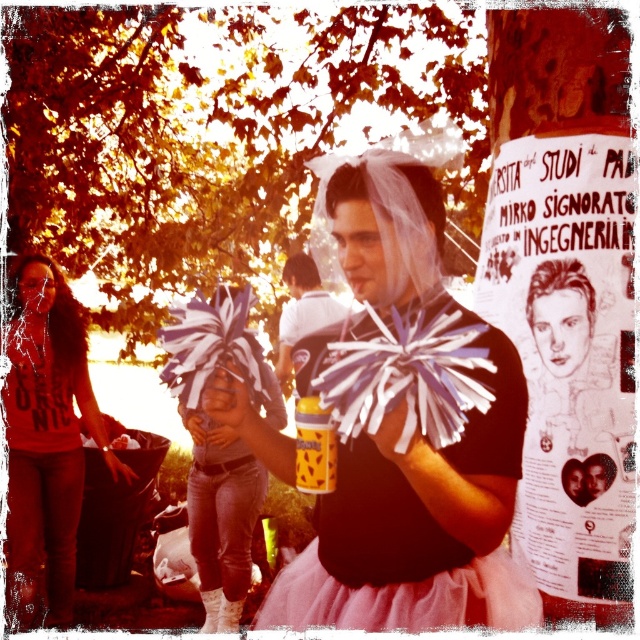
Question: Among these points, which one is nearest to the camera?

Choices:
 (A) (611, 529)
 (B) (310, 596)
 (C) (248, 524)
 (D) (49, 285)

Answer: (B)

Question: Is white paper poster at center positioned before pink tulle skirt at center?

Choices:
 (A) yes
 (B) no

Answer: (B)

Question: Is matte black hoodie at center further to camera compared to white tulle tutu at center?

Choices:
 (A) no
 (B) yes

Answer: (B)

Question: Does golden leaves at upper left appear on the right side of pink tulle skirt at center?

Choices:
 (A) no
 (B) yes

Answer: (A)

Question: Which of the following is the closest to the observer?

Choices:
 (A) (x=296, y=268)
 (B) (x=355, y=330)
 (C) (x=262, y=131)

Answer: (B)

Question: Which is farther from the matte black hoodie at center?

Choices:
 (A) white fluffy pom-poms at center
 (B) pink tulle skirt at center
 (C) golden leaves at upper left

Answer: (B)